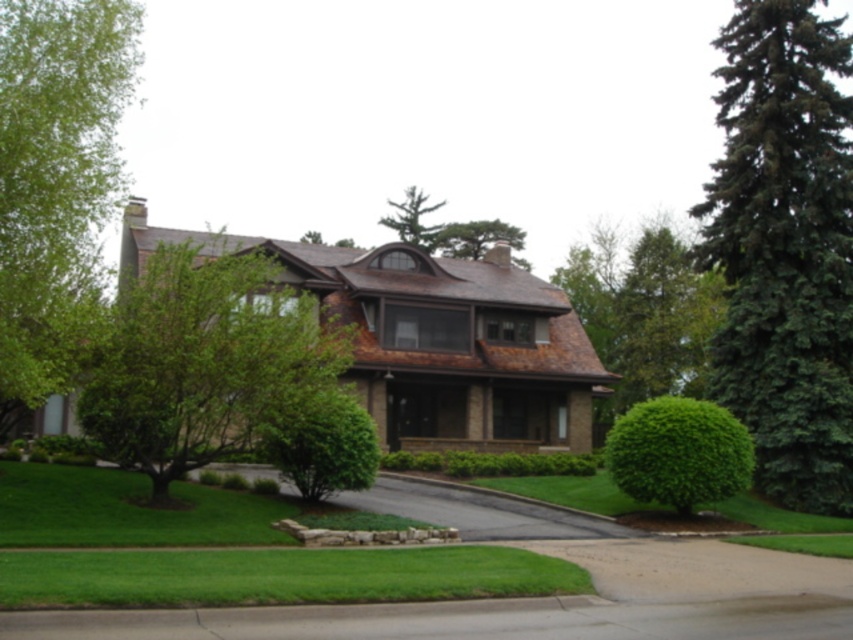
Can you confirm if green fir at right is positioned below green leafy tree at upper right?

No.

In the scene shown: Is the position of green fir at right less distant than that of green leafy tree at upper right?

Yes.

Locate an element on the screen. The image size is (853, 640). green fir at right is located at coordinates coord(784,248).

Based on the photo, between green grass at lower center and green leafy bush at center right, which one has more height?

green leafy bush at center right

Is point (267, 563) closer to viewer compared to point (660, 442)?

Yes.

Does point (218, 595) come closer to viewer compared to point (729, 429)?

Yes, point (218, 595) is in front of point (729, 429).

Locate an element on the screen. The width and height of the screenshot is (853, 640). green grass at lower center is located at coordinates tap(277, 577).

Between green leafy bush at center right and green leafy hedge at center, which one is positioned higher?

Positioned higher is green leafy bush at center right.

Does point (723, 484) come farther from viewer compared to point (579, 456)?

No.

Locate an element on the screen. The image size is (853, 640). green leafy bush at center right is located at coordinates (677, 452).

The height and width of the screenshot is (640, 853). I want to click on green leafy bush at center right, so click(677, 452).